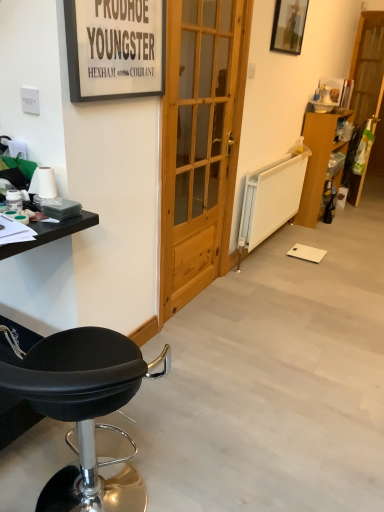
Question: Considering the relative positions of wooden picture frame at upper right, positioned as the first picture frame in top-to-bottom order, and natural wood door at center in the image provided, is wooden picture frame at upper right, positioned as the first picture frame in top-to-bottom order, to the right of natural wood door at center from the viewer's perspective?

Choices:
 (A) no
 (B) yes

Answer: (B)

Question: Is wooden picture frame at upper right, the 2th picture frame positioned from the bottom, to the left of natural wood door at center from the viewer's perspective?

Choices:
 (A) no
 (B) yes

Answer: (A)

Question: Is natural wood door at center located within wooden picture frame at upper right, the 2th picture frame in the left-to-right sequence?

Choices:
 (A) no
 (B) yes

Answer: (A)

Question: Is wooden picture frame at upper right, the 2th picture frame in the left-to-right sequence, further to the viewer compared to natural wood door at center?

Choices:
 (A) yes
 (B) no

Answer: (A)

Question: Can you confirm if wooden picture frame at upper right, positioned as the first picture frame in top-to-bottom order, is shorter than natural wood door at center?

Choices:
 (A) yes
 (B) no

Answer: (A)

Question: In terms of size, does black leather stool at lower left appear bigger or smaller than matte black picture frame at upper left, the 1th picture frame viewed from the front?

Choices:
 (A) big
 (B) small

Answer: (A)

Question: From a real-world perspective, is black leather stool at lower left above or below matte black picture frame at upper left, the 1th picture frame viewed from the front?

Choices:
 (A) below
 (B) above

Answer: (A)

Question: Considering the positions of black leather stool at lower left and matte black picture frame at upper left, positioned as the second picture frame in top-to-bottom order, in the image, is black leather stool at lower left taller or shorter than matte black picture frame at upper left, positioned as the second picture frame in top-to-bottom order,?

Choices:
 (A) short
 (B) tall

Answer: (B)

Question: In the image, is black leather stool at lower left positioned in front of or behind matte black picture frame at upper left, marked as the first picture frame in a left-to-right arrangement?

Choices:
 (A) behind
 (B) front

Answer: (B)

Question: Considering the positions of wooden picture frame at upper right, the 2th picture frame positioned from the bottom, and wooden cabinet at right in the image, is wooden picture frame at upper right, the 2th picture frame positioned from the bottom, bigger or smaller than wooden cabinet at right?

Choices:
 (A) big
 (B) small

Answer: (B)

Question: Is wooden picture frame at upper right, positioned as the first picture frame in top-to-bottom order, taller or shorter than wooden cabinet at right?

Choices:
 (A) short
 (B) tall

Answer: (A)

Question: Considering the positions of wooden picture frame at upper right, positioned as the first picture frame in top-to-bottom order, and wooden cabinet at right in the image, is wooden picture frame at upper right, positioned as the first picture frame in top-to-bottom order, wider or thinner than wooden cabinet at right?

Choices:
 (A) wide
 (B) thin

Answer: (B)

Question: Is wooden picture frame at upper right, the 1th picture frame positioned from the back, situated inside wooden cabinet at right or outside?

Choices:
 (A) outside
 (B) inside

Answer: (A)

Question: Is matte black picture frame at upper left, marked as the first picture frame in a bottom-to-top arrangement, in front of or behind wooden screen door at right in the image?

Choices:
 (A) behind
 (B) front

Answer: (B)

Question: From a real-world perspective, is matte black picture frame at upper left, positioned as the second picture frame in top-to-bottom order, positioned above or below wooden screen door at right?

Choices:
 (A) below
 (B) above

Answer: (B)